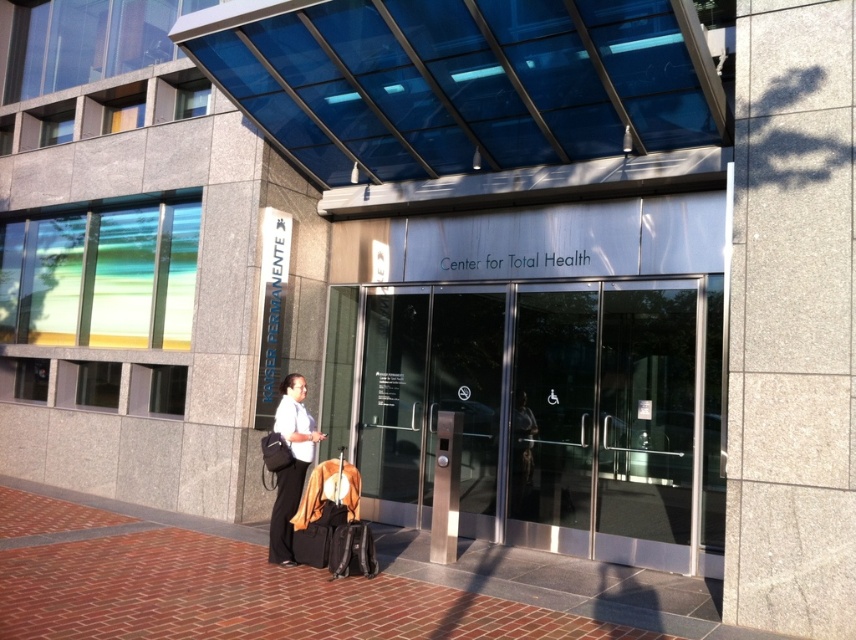
You are a delivery person approaching the entrance of the Center for Total Health. You need to place a package on the surface closest to you. Which object should you choose between the brick pavement at lower left and the brown fabric suitcase at center?

The brick pavement at lower left is closer to you than the brown fabric suitcase at center, so you should place the package on the brick pavement at lower left.

You are a delivery person trying to enter the Center for Total Health. You have a package that needs to be delivered to the office inside. The package is too large to carry through the entrance. Which object, the clear glass doors at center or the matte black backpack at lower left, is taller and could allow you to pass the package through?

The clear glass doors at center are taller than the matte black backpack at lower left, so you can pass the package through the clear glass doors at center.

Looking at this image, you are a delivery person trying to park your 1.2 meter wide cart near the entrance of the Center for Total Health. There is a brick pavement at lower left and a brown fabric suitcase at center. Can you fit your cart between them?

The brick pavement at lower left is smaller than the brown fabric suitcase at center, but without knowing the exact distance between them, it is impossible to determine if the 1.2 meter wide cart can fit between them.